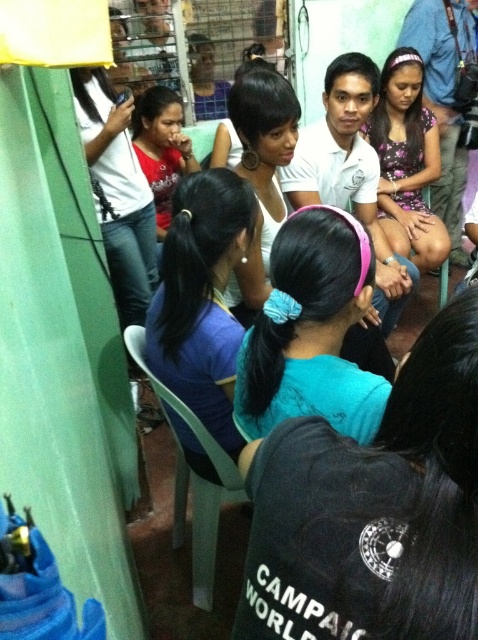
Question: Which object is the closest to the floral-patterned dress at center?

Choices:
 (A) teal matte headband at center
 (B) white matte headband at center
 (C) matte red shirt at center
 (D) white cotton shirt at center

Answer: (D)

Question: Among these objects, which one is farthest from the camera?

Choices:
 (A) white matte headband at center
 (B) floral-patterned dress at center
 (C) blue fabric shirt at center
 (D) white cotton shirt at center

Answer: (B)

Question: Is blue fabric shirt at center in front of white cotton shirt at center?

Choices:
 (A) yes
 (B) no

Answer: (A)

Question: Can you confirm if teal matte shirt at center is positioned to the left of blue fabric shirt at center?

Choices:
 (A) yes
 (B) no

Answer: (B)

Question: Which point is farther to the camera?

Choices:
 (A) (308, 577)
 (B) (413, 243)
 (C) (352, 163)
 (D) (161, 92)

Answer: (D)

Question: Is white matte headband at center further to camera compared to matte red shirt at center?

Choices:
 (A) no
 (B) yes

Answer: (A)